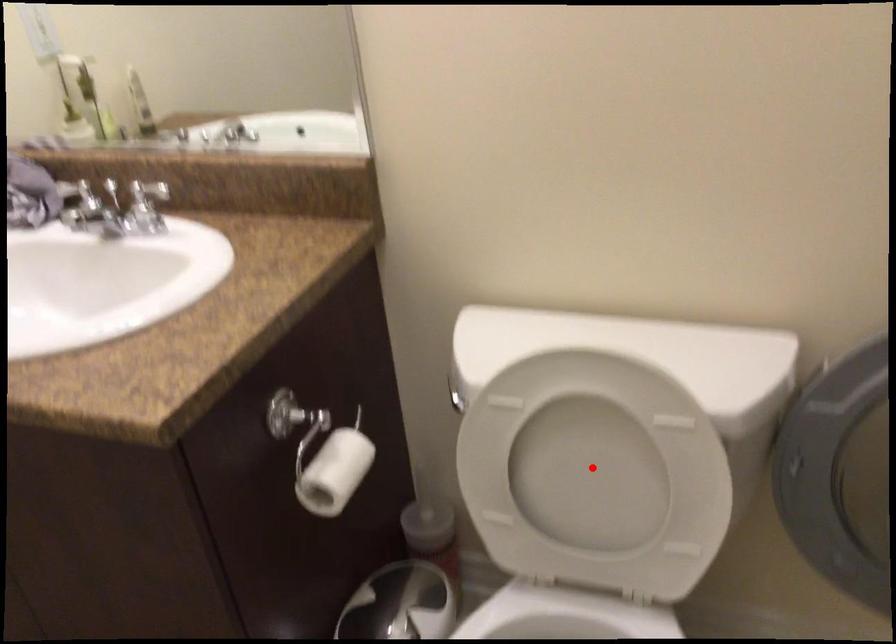
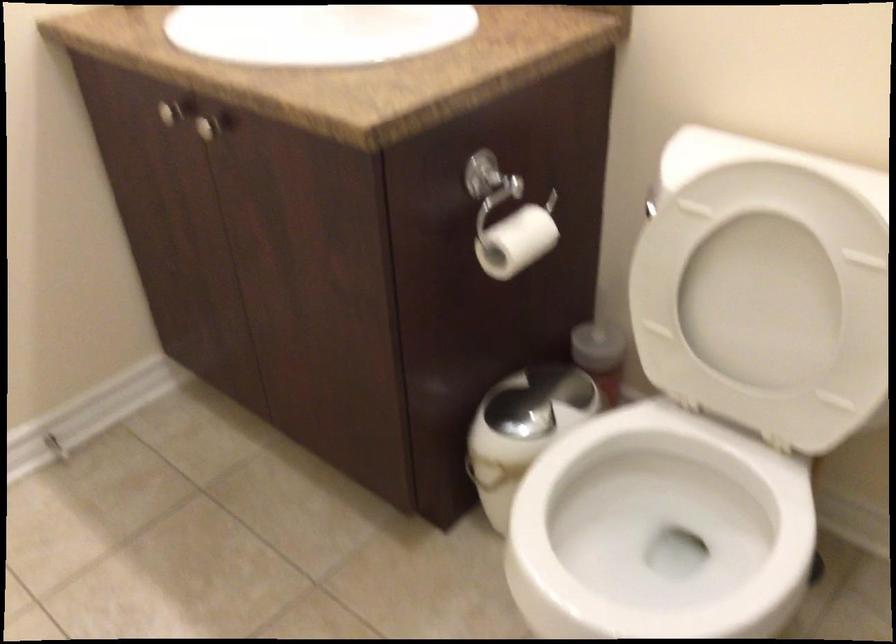
Where in the second image is the point corresponding to the highlighted location from the first image?

(763, 299)